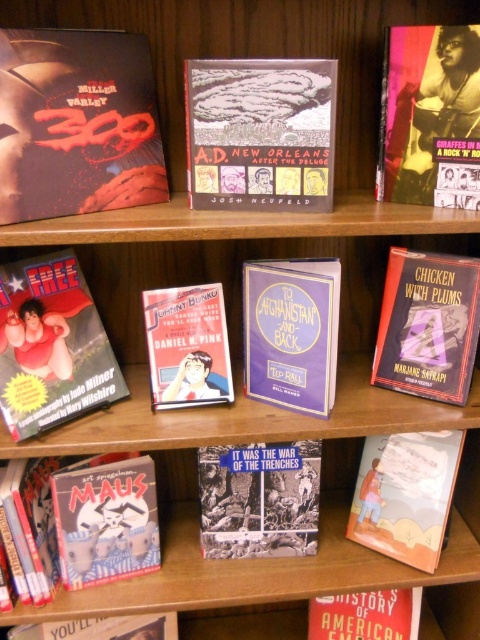
Question: Which of these objects is positioned closest to the black paper book at center?

Choices:
 (A) black paper book at lower left
 (B) matte paper book at lower right
 (C) matte hardcover book at center

Answer: (A)

Question: Can you confirm if matte red superhero at lower left is positioned above matte hardcover book at center?

Choices:
 (A) no
 (B) yes

Answer: (B)

Question: Which point is closer to the camera?

Choices:
 (A) hardcover book at upper right
 (B) hardcover book at center right
 (C) metallic gold guitar at upper right
 (D) matte red superhero at lower left

Answer: (C)

Question: Does hardcover book at center right appear over purple matte book at center?

Choices:
 (A) no
 (B) yes

Answer: (B)

Question: Is matte black comic book at upper left to the right of black paper book at lower left from the viewer's perspective?

Choices:
 (A) yes
 (B) no

Answer: (A)

Question: Among these points, which one is nearest to the camera?

Choices:
 (A) (468, 145)
 (B) (111, 632)
 (C) (52, 388)

Answer: (A)